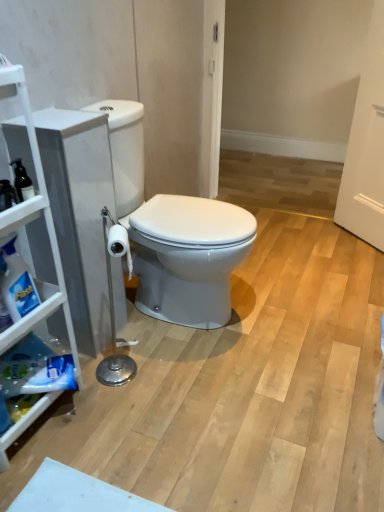
Measure the distance between translucent plastic spray bottle at left and camera.

1.14 meters.

Locate an element on the screen. white glossy toilet at center is located at coordinates (174, 234).

Where is `translucent plastic spray bottle at left`? This screenshot has height=512, width=384. translucent plastic spray bottle at left is located at coordinates (17, 281).

Is white glossy toilet at center behind translucent plastic spray bottle at left?

That is True.

Are white glossy toilet at center and translucent plastic spray bottle at left beside each other?

They are not placed beside each other.

From a real-world perspective, is white glossy toilet at center physically below translucent plastic spray bottle at left?

Correct, in the physical world, white glossy toilet at center is lower than translucent plastic spray bottle at left.

Consider the image. How different are the orientations of white glossy toilet at center and translucent plastic spray bottle at left in degrees?

There is a 3.99-degree angle between the facing directions of white glossy toilet at center and translucent plastic spray bottle at left.

Does translucent plastic spray bottle at left have a lesser height compared to white matte cabinet at left?

Yes.

Considering the positions of objects translucent plastic spray bottle at left and white matte cabinet at left in the image provided, who is more to the left, translucent plastic spray bottle at left or white matte cabinet at left?

white matte cabinet at left.

This screenshot has height=512, width=384. Find the location of `cleaning product below the white matte cabinet at left (from the image's perspective)`. cleaning product below the white matte cabinet at left (from the image's perspective) is located at coordinates (17, 281).

Is translucent plastic spray bottle at left positioned far away from white matte cabinet at left?

No, translucent plastic spray bottle at left is not far from white matte cabinet at left.

Considering the sizes of objects white glossy toilet at center and white matte cabinet at left in the image provided, who is bigger, white glossy toilet at center or white matte cabinet at left?

Bigger between the two is white glossy toilet at center.

Which point is more forward, (x=149, y=217) or (x=49, y=210)?

The point (x=49, y=210) is closer.

Looking at this image, is white glossy toilet at center outside of white matte cabinet at left?

Yes.

Considering the positions of objects white glossy toilet at center and white matte cabinet at left in the image provided, who is more to the left, white glossy toilet at center or white matte cabinet at left?

white matte cabinet at left is more to the left.

How many degrees apart are the facing directions of white matte cabinet at left and white glossy toilet at center?

The facing directions of white matte cabinet at left and white glossy toilet at center are 0.925 degrees apart.

Is white matte cabinet at left to the left or to the right of white glossy toilet at center in the image?

In the image, white matte cabinet at left appears on the left side of white glossy toilet at center.

Is white matte cabinet at left inside or outside of white glossy toilet at center?

The correct answer is: outside.

Considering the sizes of translucent plastic spray bottle at left and white glossy toilet at center in the image, is translucent plastic spray bottle at left wider or thinner than white glossy toilet at center?

In the image, translucent plastic spray bottle at left appears to be more narrow than white glossy toilet at center.

Are translucent plastic spray bottle at left and white glossy toilet at center making contact?

No, translucent plastic spray bottle at left is not touching white glossy toilet at center.

Where is `toilet below the translucent plastic spray bottle at left (from a real-world perspective)`? Image resolution: width=384 pixels, height=512 pixels. toilet below the translucent plastic spray bottle at left (from a real-world perspective) is located at coordinates click(x=174, y=234).

Is translucent plastic spray bottle at left not inside white glossy toilet at center?

Yes.

Considering their positions, is white matte cabinet at left located in front of or behind translucent plastic spray bottle at left?

white matte cabinet at left is in front of translucent plastic spray bottle at left.

Is white matte cabinet at left positioned far away from translucent plastic spray bottle at left?

That's not correct — white matte cabinet at left is a little close to translucent plastic spray bottle at left.

What's the angular difference between white matte cabinet at left and translucent plastic spray bottle at left's facing directions?

The facing directions of white matte cabinet at left and translucent plastic spray bottle at left are 3.07 degrees apart.

Is white matte cabinet at left to the left or to the right of translucent plastic spray bottle at left in the image?

white matte cabinet at left is to the left of translucent plastic spray bottle at left.

In the image, there is a translucent plastic spray bottle at left. Identify the location of toilet below it (from a real-world perspective). (174, 234).

At what (x,y) coordinates should I click in order to perform the action: click on cabinetry in front of the translucent plastic spray bottle at left. Please return your answer as a coordinate pair (x, y). This screenshot has width=384, height=512. Looking at the image, I should click on (47, 229).

Considering their positions, is white glossy toilet at center positioned closer to translucent plastic spray bottle at left than white matte cabinet at left?

white matte cabinet at left is closer to translucent plastic spray bottle at left.

When comparing their distances from white matte cabinet at left, does white glossy toilet at center or translucent plastic spray bottle at left seem further?

Based on the image, white glossy toilet at center appears to be further to white matte cabinet at left.

Consider the image. Based on their spatial positions, is translucent plastic spray bottle at left or white glossy toilet at center further from white matte cabinet at left?

white glossy toilet at center is further to white matte cabinet at left.

Which object lies nearer to the anchor point white glossy toilet at center, white matte cabinet at left or translucent plastic spray bottle at left?

The object closer to white glossy toilet at center is white matte cabinet at left.

Looking at the image, which one is located further to white glossy toilet at center, translucent plastic spray bottle at left or white matte cabinet at left?

translucent plastic spray bottle at left is further to white glossy toilet at center.

Considering their positions, is white matte cabinet at left positioned further to translucent plastic spray bottle at left than white glossy toilet at center?

white glossy toilet at center is further to translucent plastic spray bottle at left.

The image size is (384, 512). Identify the location of cleaning product located between white matte cabinet at left and white glossy toilet at center in the depth direction. (17, 281).